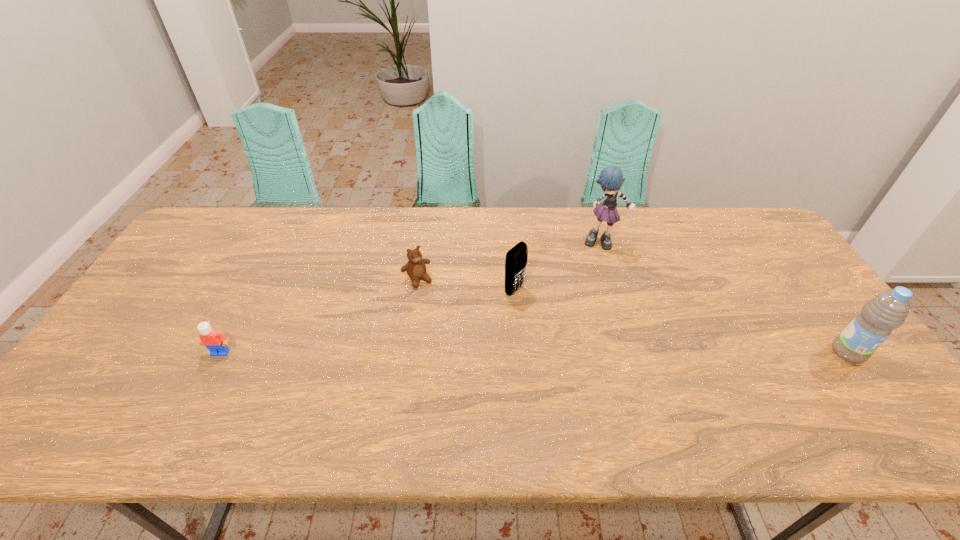
I want to click on object situated at the right edge, so click(887, 311).

This screenshot has width=960, height=540. I want to click on vacant space at the far edge of the desktop, so click(382, 225).

Locate an element on the screen. Image resolution: width=960 pixels, height=540 pixels. blank space at the near edge of the desktop is located at coordinates (496, 404).

This screenshot has height=540, width=960. I want to click on vacant space at the left edge of the desktop, so click(143, 314).

Where is `vacant space at the right edge of the desktop`? This screenshot has height=540, width=960. vacant space at the right edge of the desktop is located at coordinates (797, 332).

At what (x,y) coordinates should I click in order to perform the action: click on vacant space at the near left corner. Please return your answer as a coordinate pair (x, y). Looking at the image, I should click on (79, 384).

This screenshot has width=960, height=540. Find the location of `free point between the Lego and the water bottle`. free point between the Lego and the water bottle is located at coordinates (534, 353).

Find the location of a particular element. vacant area that lies between the cellular telephone and the leftmost object is located at coordinates (368, 322).

Image resolution: width=960 pixels, height=540 pixels. In order to click on vacant space that is in between the rightmost object and the third object from right to left in this screenshot , I will do `click(681, 322)`.

At what (x,y) coordinates should I click in order to perform the action: click on empty location between the third object from left to right and the water bottle. Please return your answer as a coordinate pair (x, y). Looking at the image, I should click on (681, 322).